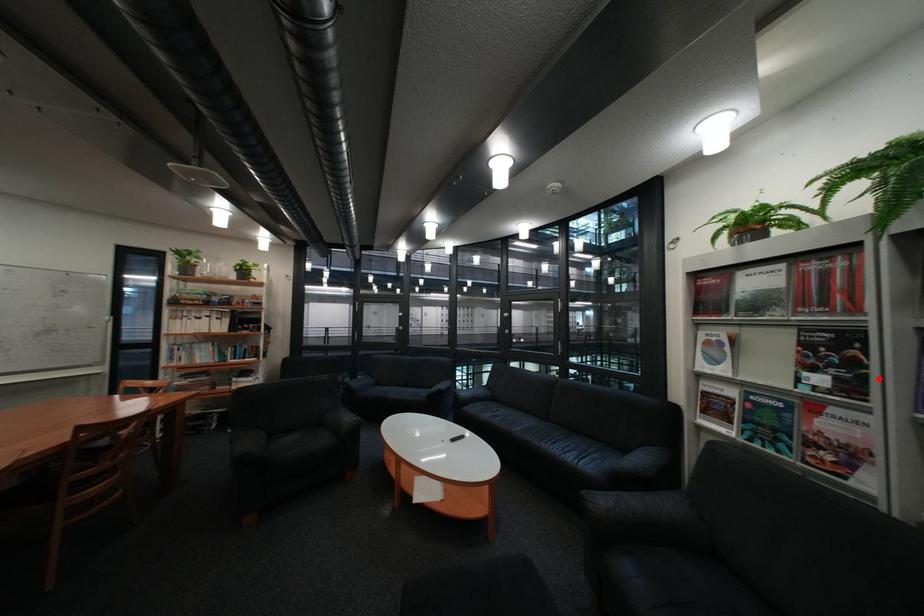
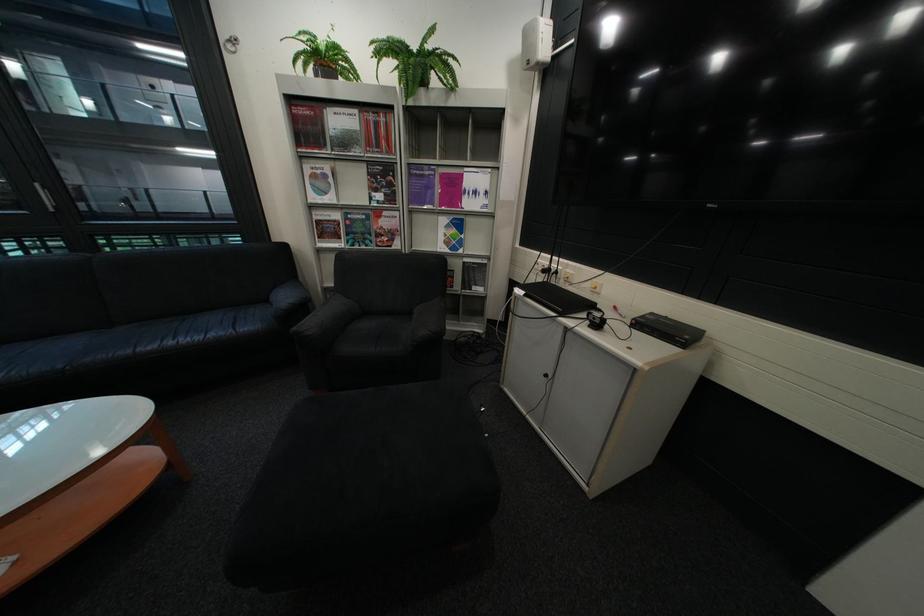
Find the pixel in the second image that matches the highlighted location in the first image.

(409, 192)